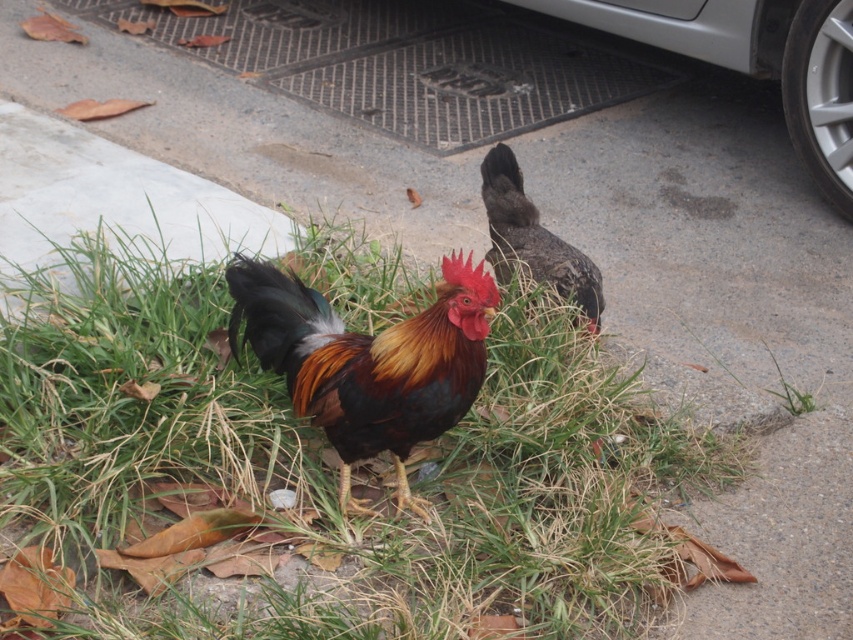
You are a small insect trying to move from the green grass at center to the dark brown feathers at center. Can you crawl directly between them without going around?

The green grass at center is closer to the viewer than dark brown feathers at center, so you would have to go around since they are not directly in line with each other.

You are standing at the edge of the grassy patch and want to walk to the paved area. The paved area is behind the rooster. To avoid stepping on the green grass at center, which is located at point (335, 467), should you walk around the rooster on the left or the right side?

To avoid stepping on the green grass at center, you should walk around the rooster on the left side because the paved area is behind the rooster and the grass is at point (335, 467), which is in the center. Walking around the left would bypass the grass area.

You are a birdwatcher trying to observe two chickens in a grassy area. You see the bright orange and black feathers at center and the dark brown feathers at center. How far apart are these two chickens?

The bright orange and black feathers at center and dark brown feathers at center are 36.63 inches apart.